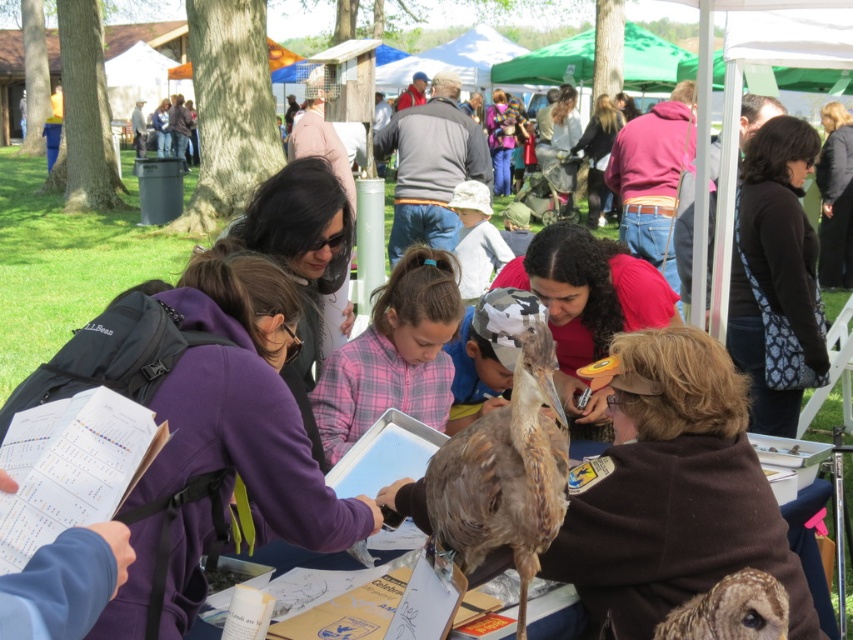
Question: Which point appears closest to the camera in this image?

Choices:
 (A) (372, 348)
 (B) (840, 163)

Answer: (A)

Question: Among these points, which one is nearest to the camera?

Choices:
 (A) (618, 113)
 (B) (177, 390)
 (C) (843, 148)

Answer: (B)

Question: Does purple fleece jacket at center appear under black wool coat at upper right?

Choices:
 (A) no
 (B) yes

Answer: (B)

Question: Observing the image, what is the correct spatial positioning of purple fleece jacket at center in reference to brown speckled owl at lower right?

Choices:
 (A) above
 (B) below

Answer: (A)

Question: Is brown speckled owl at lower right further to the viewer compared to matte pink hoodie at center?

Choices:
 (A) yes
 (B) no

Answer: (B)

Question: Which object appears closest to the camera in this image?

Choices:
 (A) brown feathered bird at center
 (B) matte black jacket at center
 (C) white cotton hat at center

Answer: (A)